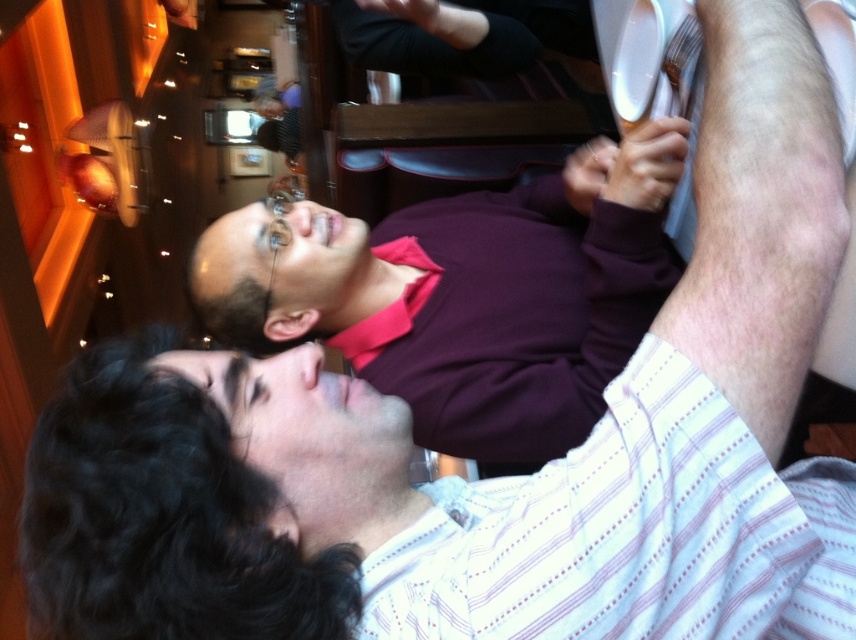
Question: Does maroon shirt at upper center have a smaller size compared to white striped shirt at upper right?

Choices:
 (A) yes
 (B) no

Answer: (B)

Question: Does maroon shirt at upper center have a lesser width compared to white striped shirt at upper right?

Choices:
 (A) no
 (B) yes

Answer: (A)

Question: Which point is closer to the camera?

Choices:
 (A) (508, 502)
 (B) (444, 218)

Answer: (A)

Question: Does maroon shirt at upper center have a greater width compared to white striped shirt at upper right?

Choices:
 (A) yes
 (B) no

Answer: (A)

Question: Which of the following is the closest to the observer?

Choices:
 (A) (819, 570)
 (B) (278, 328)

Answer: (A)